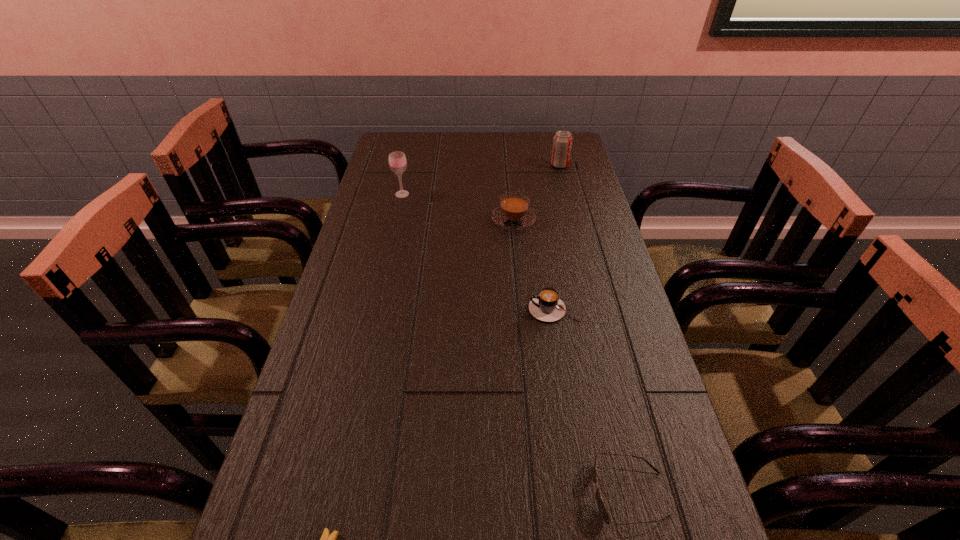
Locate an element on the screen. This screenshot has width=960, height=540. soda can that is at the right edge is located at coordinates [562, 143].

I want to click on cappuccino at the right edge, so click(547, 306).

Find the location of a particular element. sunglasses that is at the right edge is located at coordinates point(602,509).

Identify the location of object situated at the far right corner. pos(562,143).

In the image, there is a desktop. Where is `blank space at the far edge`? This screenshot has width=960, height=540. blank space at the far edge is located at coordinates click(x=460, y=149).

Image resolution: width=960 pixels, height=540 pixels. I want to click on vacant region at the left edge of the desktop, so pos(359,228).

The height and width of the screenshot is (540, 960). In the image, there is a desktop. What are the coordinates of `vacant space at the right edge` in the screenshot? It's located at (584, 171).

You are a GUI agent. You are given a task and a screenshot of the screen. Output one action in this format:
    pyautogui.click(x=<x>, y=<y>)
    Task: Click on the free region at the far left corner of the desktop
    This screenshot has height=540, width=960.
    Given the screenshot: What is the action you would take?
    pyautogui.click(x=381, y=145)

The height and width of the screenshot is (540, 960). I want to click on free space at the far right corner of the desktop, so click(x=545, y=140).

Find the location of a particular element. free space between the taller cappuccino and the wineglass is located at coordinates (458, 207).